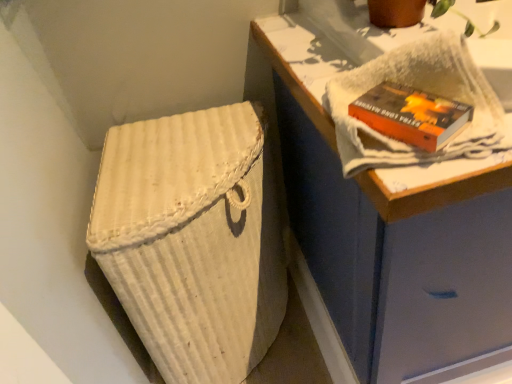
Question: Would you say orange matte paperback book at upper right is outside white textured towel at upper right?

Choices:
 (A) no
 (B) yes

Answer: (A)

Question: Does orange matte paperback book at upper right appear on the right side of white textured towel at upper right?

Choices:
 (A) yes
 (B) no

Answer: (B)

Question: Is orange matte paperback book at upper right at the left side of white textured towel at upper right?

Choices:
 (A) no
 (B) yes

Answer: (B)

Question: From a real-world perspective, is orange matte paperback book at upper right under white textured towel at upper right?

Choices:
 (A) no
 (B) yes

Answer: (B)

Question: From a real-world perspective, is orange matte paperback book at upper right on top of white textured towel at upper right?

Choices:
 (A) no
 (B) yes

Answer: (A)

Question: Considering the relative positions of orange matte paperback book at upper right and white textured towel at upper right in the image provided, is orange matte paperback book at upper right in front of white textured towel at upper right?

Choices:
 (A) yes
 (B) no

Answer: (B)

Question: Is white woven laundry basket at lower left bigger than white woven basket at lower left?

Choices:
 (A) no
 (B) yes

Answer: (A)

Question: From the image's perspective, is white woven laundry basket at lower left below white woven basket at lower left?

Choices:
 (A) no
 (B) yes

Answer: (B)

Question: Is white woven laundry basket at lower left far away from white woven basket at lower left?

Choices:
 (A) yes
 (B) no

Answer: (B)

Question: Considering the relative positions of white woven laundry basket at lower left and white woven basket at lower left in the image provided, is white woven laundry basket at lower left to the right of white woven basket at lower left from the viewer's perspective?

Choices:
 (A) no
 (B) yes

Answer: (A)

Question: Is white woven laundry basket at lower left located outside white woven basket at lower left?

Choices:
 (A) no
 (B) yes

Answer: (B)

Question: Is white woven basket at lower left a part of white woven laundry basket at lower left?

Choices:
 (A) yes
 (B) no

Answer: (B)

Question: Is white woven basket at lower left far from white woven laundry basket at lower left?

Choices:
 (A) yes
 (B) no

Answer: (B)